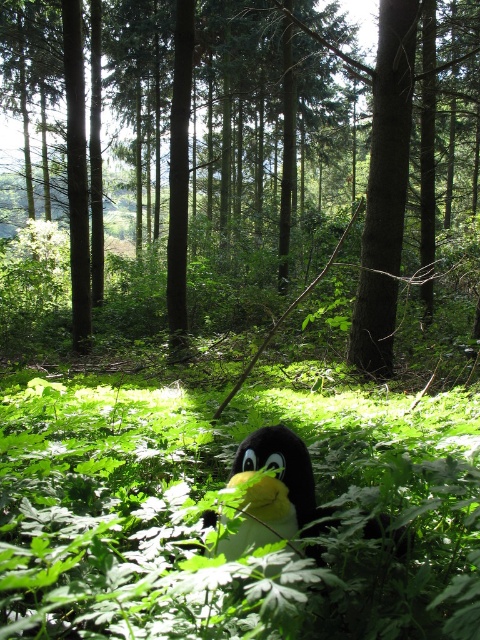
Based on the photo, can you confirm if brown textured tree at center is positioned below soft plush penguin at center?

Incorrect, brown textured tree at center is not positioned below soft plush penguin at center.

Consider the image. Is brown textured tree at center shorter than soft plush penguin at center?

No, brown textured tree at center is not shorter than soft plush penguin at center.

This screenshot has width=480, height=640. I want to click on brown textured tree at center, so coord(331,147).

Where is `brown textured tree at center`? brown textured tree at center is located at coordinates (331, 147).